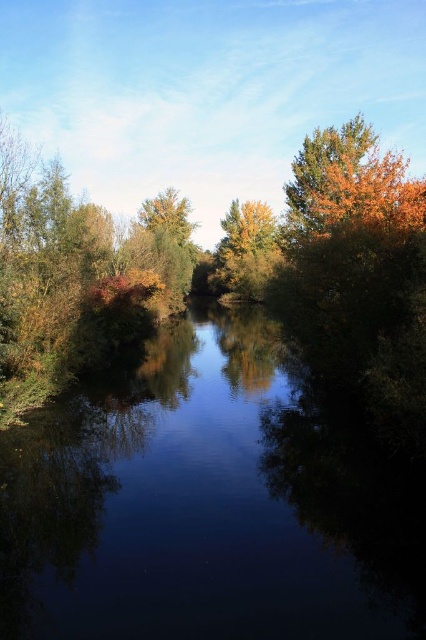
Measure the distance between point (170,573) and camera.

The distance of point (170,573) from camera is 7.96 meters.

Where is `dark reflective water at center`? This screenshot has height=640, width=426. dark reflective water at center is located at coordinates (204, 506).